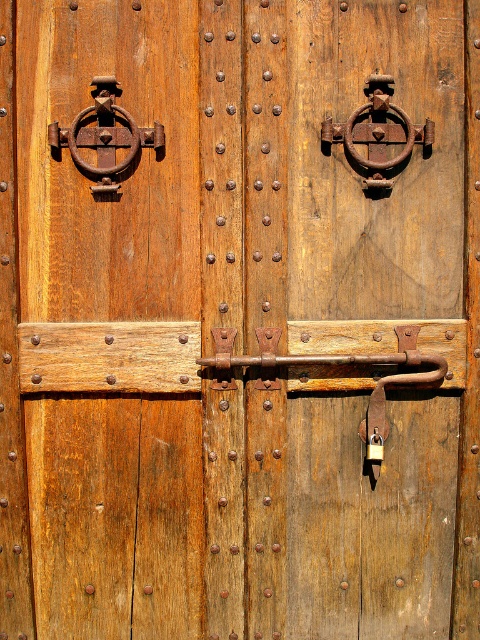
You are a blacksmith inspecting two rusty metal rings on a medieval door. The door has a rusty metal ring at upper center and a rusty metal ring at upper left. Which of these two rings is shorter in height?

The rusty metal ring at upper center is shorter in height than the rusty metal ring at upper left.

You are an architect examining the fortified wooden door and notice two points marked on it. The first point is at coordinates point (431, 134) and the second is at point (149, 140). Which point is closer to you as you face the door?

Point (431, 134) is closer to you than point (149, 140) because it is further to the viewer according to the description.

You are an architect inspecting the door and need to determine which object is bigger between the rustic wood knocker at upper left and the rusty metal ring at upper center. Can you identify the larger one?

Answer: The rustic wood knocker at upper left is larger in size than the rusty metal ring at upper center, so the rustic wood knocker at upper left is the larger one.